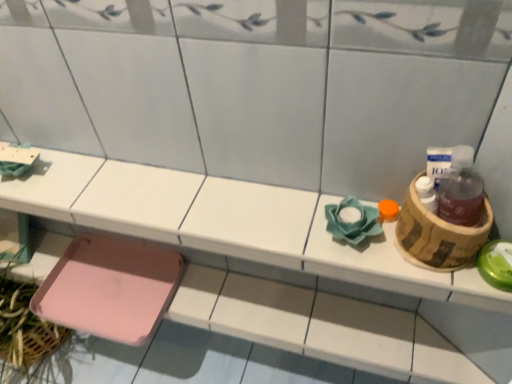
Identify the location of free region on the left part of brown cardboard basket at right. This screenshot has width=512, height=384. (334, 239).